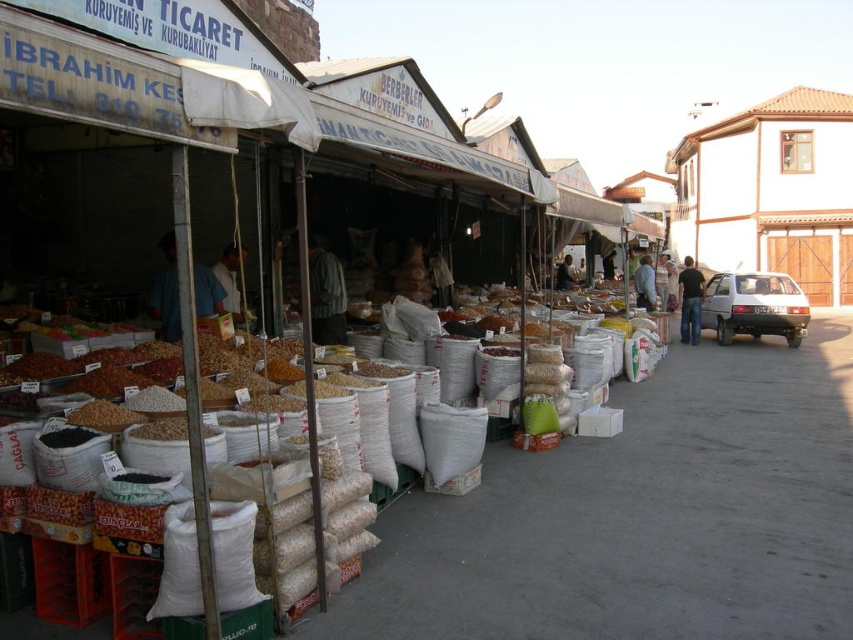
Question: Which object is farther from the camera taking this photo?

Choices:
 (A) brown grain at center
 (B) blue shirt at center
 (C) green striped shirt at center
 (D) blue denim shirt at center

Answer: (D)

Question: Is green striped shirt at center further to the viewer compared to brown grain at center?

Choices:
 (A) no
 (B) yes

Answer: (B)

Question: Which object is the farthest from the striped fabric shirt at center?

Choices:
 (A) brown grain at center
 (B) dark blue shirt at center
 (C) black cotton shirt at center
 (D) blue denim shirt at center

Answer: (A)

Question: Can you confirm if striped fabric shirt at center is positioned to the right of dark blue shirt at center?

Choices:
 (A) no
 (B) yes

Answer: (B)

Question: Which of the following is the closest to the observer?

Choices:
 (A) (166, 429)
 (B) (672, 296)

Answer: (A)

Question: Does white fabric at center have a smaller size compared to blue denim shirt at center?

Choices:
 (A) no
 (B) yes

Answer: (A)